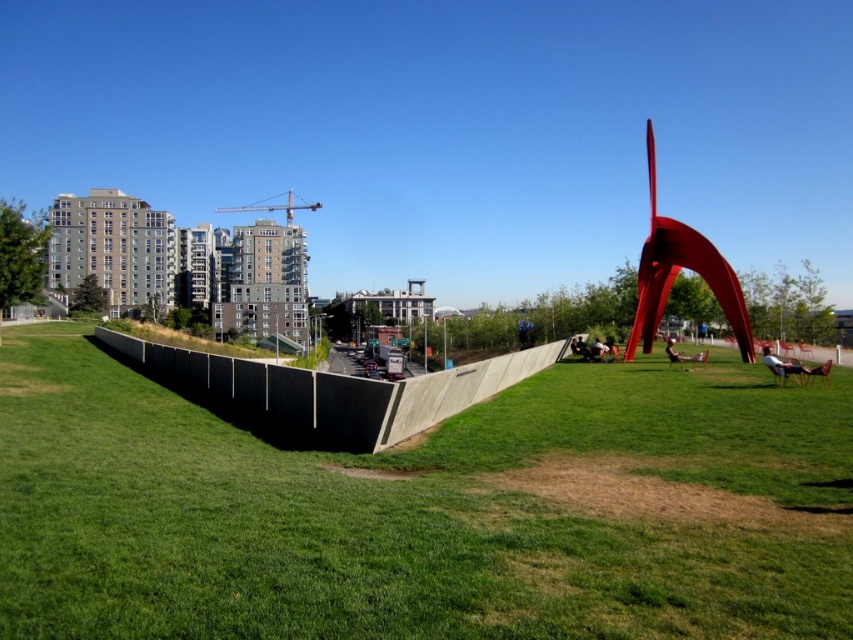
From the picture: Does green grassy at center lie behind polished red metal abstract art at right?

No, green grassy at center is closer to the viewer.

Which is more to the left, green grassy at center or polished red metal abstract art at right?

From the viewer's perspective, green grassy at center appears more on the left side.

Is point (410, 534) farther from viewer compared to point (676, 269)?

That is False.

This screenshot has height=640, width=853. Identify the location of green grassy at center. pos(424,509).